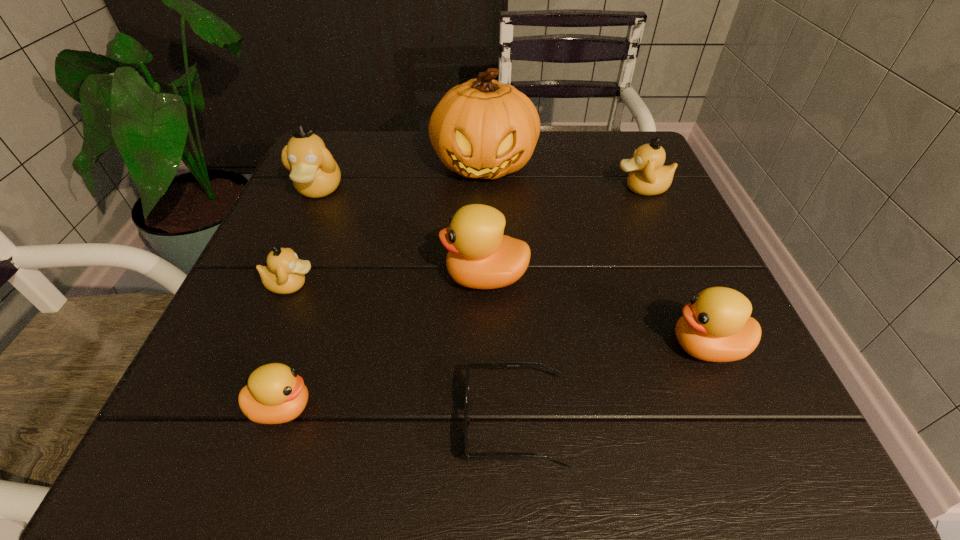
Identify the location of the tallest object. This screenshot has width=960, height=540. (483, 128).

Image resolution: width=960 pixels, height=540 pixels. Identify the location of the biggest tan duckling. (314, 172).

Locate an element on the screen. The image size is (960, 540). the second yellow duckling from right to left is located at coordinates (479, 256).

The image size is (960, 540). I want to click on the biggest yellow duckling, so click(x=479, y=256).

At what (x,y) coordinates should I click in order to perform the action: click on the rightmost tan duckling. Please return your answer as a coordinate pair (x, y). Looking at the image, I should click on (648, 176).

Locate an element on the screen. The height and width of the screenshot is (540, 960). the second nearest duckling is located at coordinates (716, 326).

At what (x,y) coordinates should I click in order to perform the action: click on the second biggest yellow duckling. Please return your answer as a coordinate pair (x, y). This screenshot has height=540, width=960. Looking at the image, I should click on coord(716,326).

I want to click on the smallest tan duckling, so click(x=284, y=274).

Identify the location of the nearest duckling. Image resolution: width=960 pixels, height=540 pixels. (275, 394).

Find the location of a particular element. The width and height of the screenshot is (960, 540). the nearest yellow duckling is located at coordinates (275, 394).